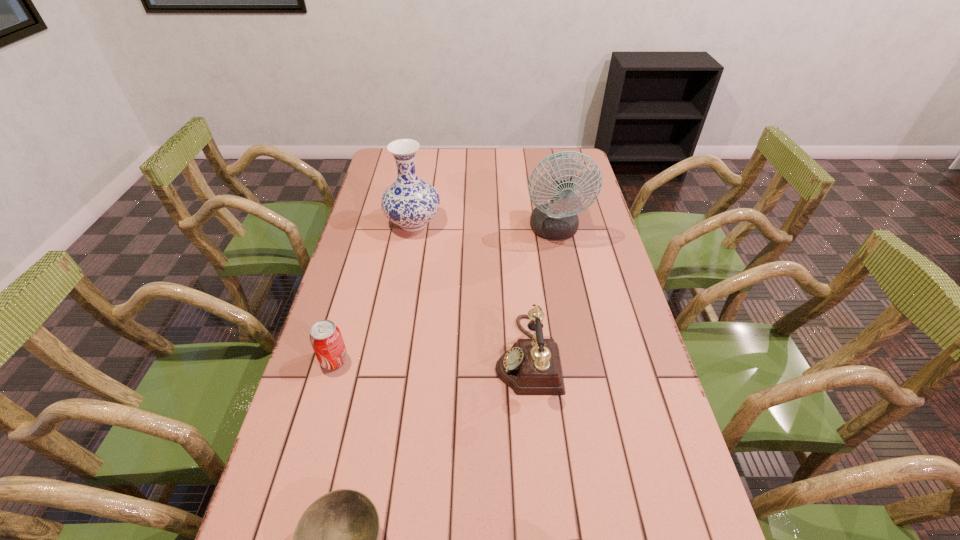
Find the location of `free space that satisfies the following two spatial constraints: 1. on the dial of the telephone; 2. on the front side of the soda`. free space that satisfies the following two spatial constraints: 1. on the dial of the telephone; 2. on the front side of the soda is located at coordinates (528, 360).